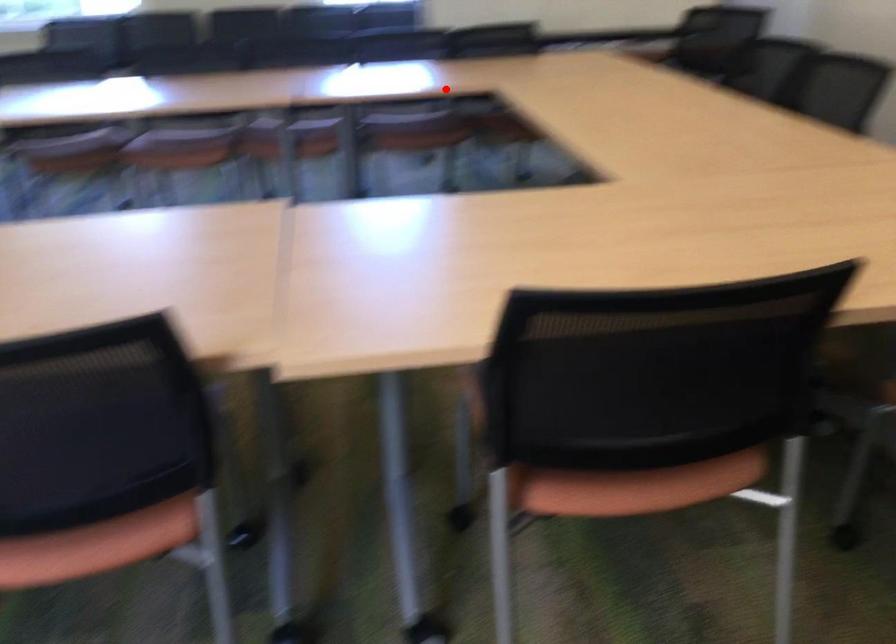
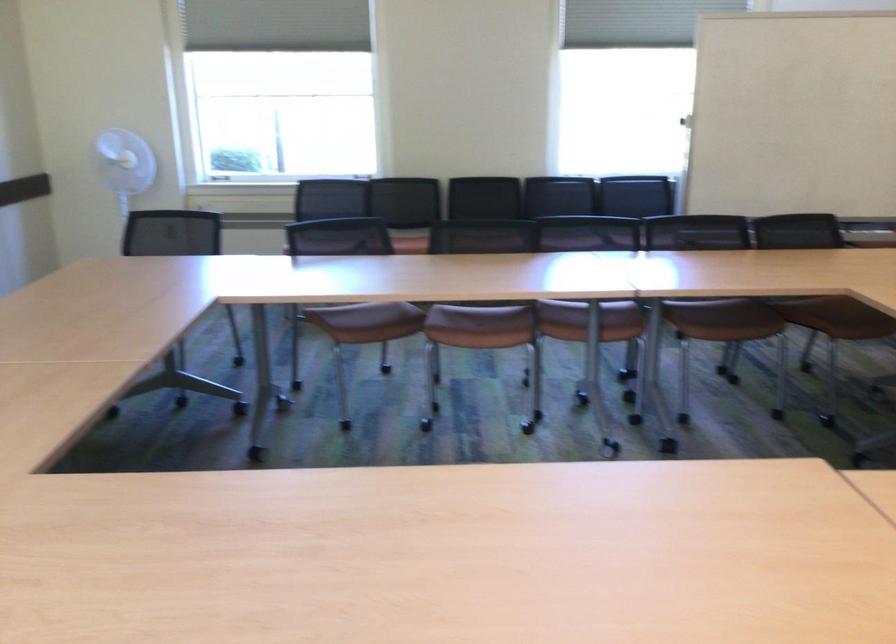
Question: I am providing you with two images of the same scene from different viewpoints. A red point is shown in image1. For the corresponding object point in image2, is it positioned nearer or farther from the camera?

Choices:
 (A) Nearer
 (B) Farther

Answer: (A)